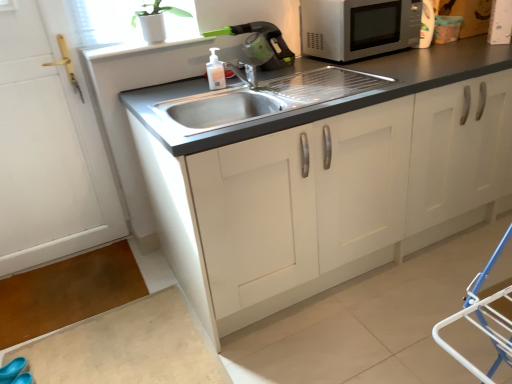
This screenshot has height=384, width=512. I want to click on free location in front of satin silver microwave at upper right, so click(x=397, y=57).